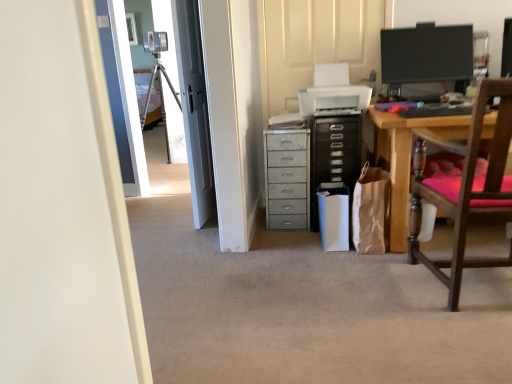
Question: Is metallic gray chest of drawers at center taller than wooden chair with pink cushion at right?

Choices:
 (A) no
 (B) yes

Answer: (A)

Question: From the image's perspective, does metallic gray chest of drawers at center appear lower than wooden chair with pink cushion at right?

Choices:
 (A) no
 (B) yes

Answer: (A)

Question: Considering the relative positions of metallic gray chest of drawers at center and wooden chair with pink cushion at right in the image provided, is metallic gray chest of drawers at center behind wooden chair with pink cushion at right?

Choices:
 (A) no
 (B) yes

Answer: (B)

Question: Is metallic gray chest of drawers at center aimed at wooden chair with pink cushion at right?

Choices:
 (A) yes
 (B) no

Answer: (B)

Question: Is wooden chair with pink cushion at right located within metallic gray chest of drawers at center?

Choices:
 (A) yes
 (B) no

Answer: (B)

Question: Choose the correct answer: Is wooden chair with pink cushion at right inside metallic gray chest of drawers at center or outside it?

Choices:
 (A) inside
 (B) outside

Answer: (B)

Question: Considering the positions of wooden chair with pink cushion at right and metallic gray chest of drawers at center in the image, is wooden chair with pink cushion at right wider or thinner than metallic gray chest of drawers at center?

Choices:
 (A) wide
 (B) thin

Answer: (A)

Question: Considering the positions of wooden chair with pink cushion at right and metallic gray chest of drawers at center in the image, is wooden chair with pink cushion at right bigger or smaller than metallic gray chest of drawers at center?

Choices:
 (A) small
 (B) big

Answer: (B)

Question: Does point coord(493,201) appear closer or farther from the camera than point coord(289,180)?

Choices:
 (A) farther
 (B) closer

Answer: (B)

Question: Is black glossy monitor at upper right wider or thinner than wooden chair with pink cushion at right?

Choices:
 (A) wide
 (B) thin

Answer: (B)

Question: From the image's perspective, is black glossy monitor at upper right above or below wooden chair with pink cushion at right?

Choices:
 (A) below
 (B) above

Answer: (B)

Question: Choose the correct answer: Is black glossy monitor at upper right inside wooden chair with pink cushion at right or outside it?

Choices:
 (A) inside
 (B) outside

Answer: (B)

Question: Is black glossy monitor at upper right in front of or behind wooden chair with pink cushion at right in the image?

Choices:
 (A) behind
 (B) front

Answer: (A)

Question: Considering the positions of metallic gray chest of drawers at center and black glossy monitor at upper right in the image, is metallic gray chest of drawers at center bigger or smaller than black glossy monitor at upper right?

Choices:
 (A) small
 (B) big

Answer: (B)

Question: From the image's perspective, is metallic gray chest of drawers at center located above or below black glossy monitor at upper right?

Choices:
 (A) above
 (B) below

Answer: (B)